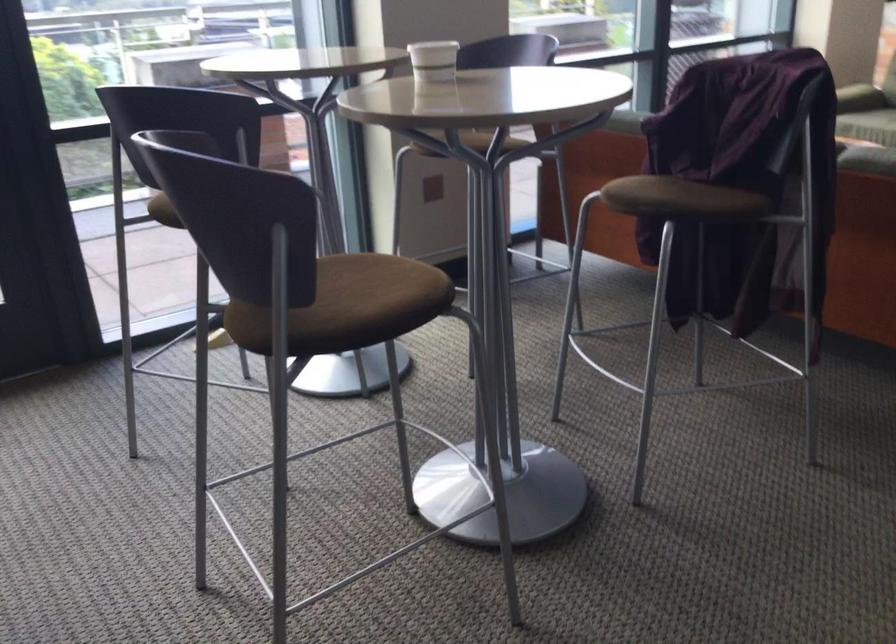
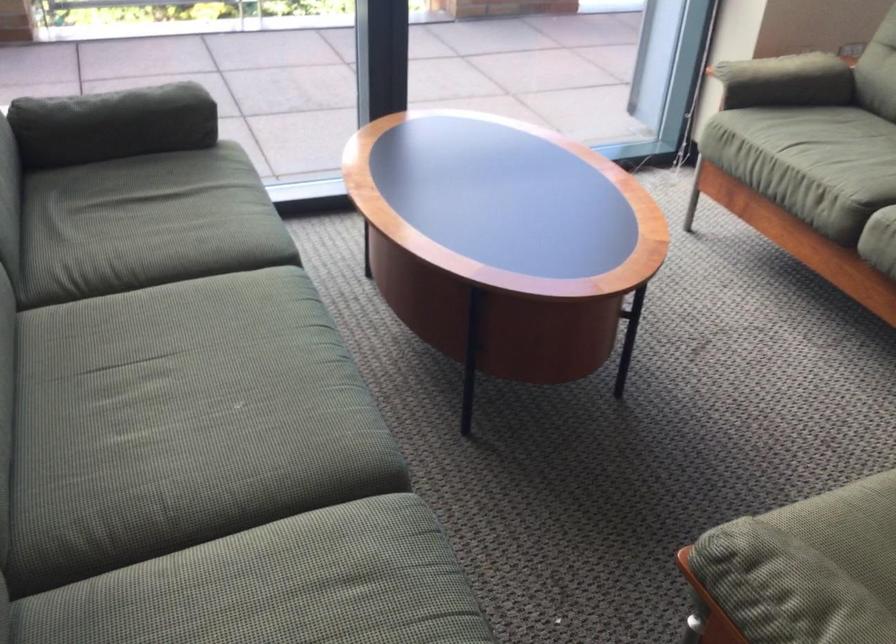
In the scene shown: Which direction would the cameraman need to move to produce the second image?

The movement direction of the cameraman is right, forward.